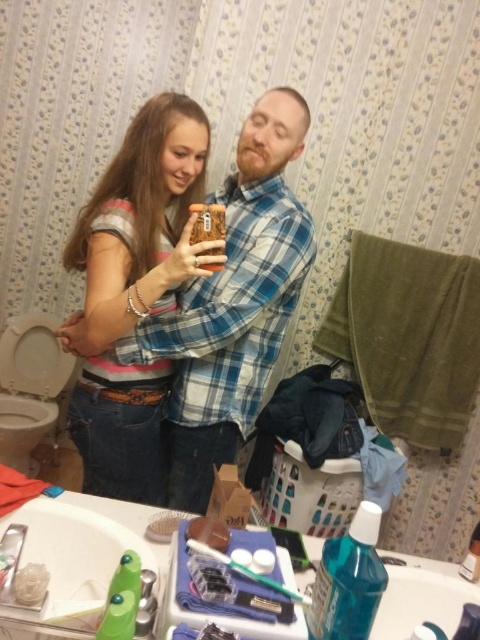
You are a delivery robot that is 0.8 meters wide. You are in the bathroom and need to deliver a package to the sink. The striped cotton shirt at center is blocking your path. Can you navigate around it?

The striped cotton shirt at center is 1.06 meters from camera, so the robot can navigate around it since it is positioned at a distance that allows enough space to move past without obstruction.

You are organizing the bathroom and want to place the striped cotton shirt at center and the translucent blue plastic mouthwash at lower right in a specific order. If you need to move the mouthwash first, which object should you move first?

The translucent blue plastic mouthwash at lower right is behind the striped cotton shirt at center, so you should move the striped cotton shirt at center first to access the mouthwash.